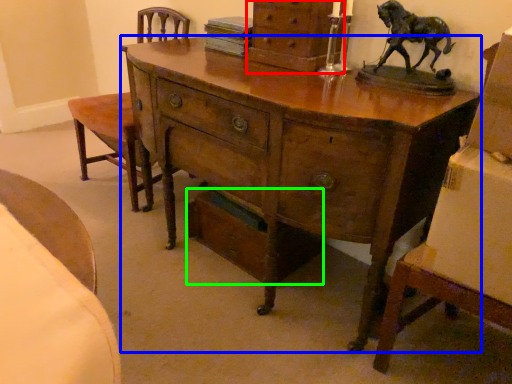
Question: Which object is the farthest from chest of drawers (highlighted by a red box)? Choose among these: desk (highlighted by a blue box) or drawer (highlighted by a green box).

Choices:
 (A) desk
 (B) drawer

Answer: (B)